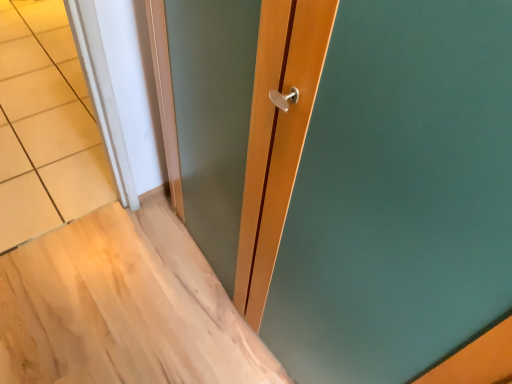
Locate an element on the screen. The width and height of the screenshot is (512, 384). white glossy tile at lower left is located at coordinates (45, 126).

What do you see at coordinates (45, 126) in the screenshot? The height and width of the screenshot is (384, 512). I see `white glossy tile at lower left` at bounding box center [45, 126].

What is the approximate width of white glossy tile at lower left?

white glossy tile at lower left is 1.62 meters wide.

Identify the location of white glossy tile at lower left. (45, 126).